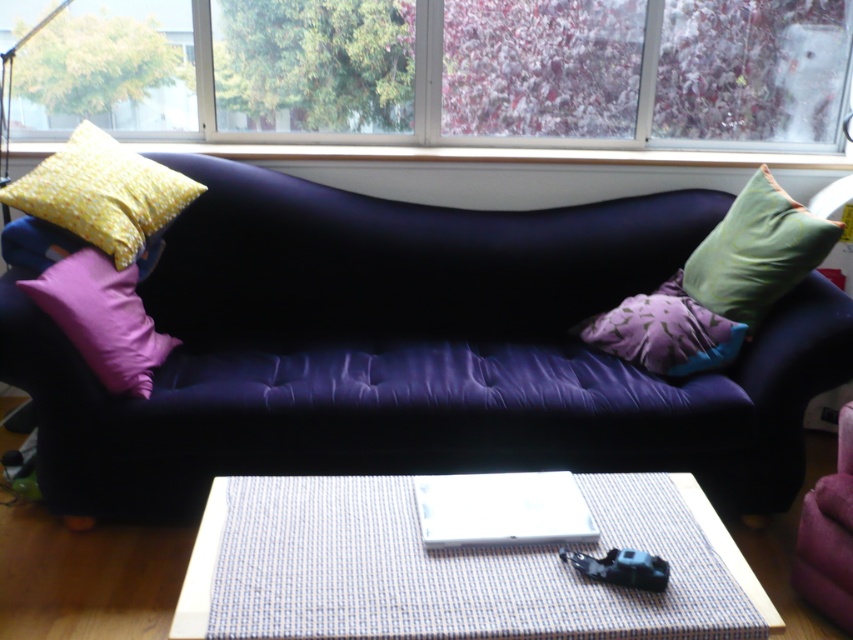
Consider the image. Is suede-like dark blue couch at center taller than purple fabric couch at lower right?

Correct, suede-like dark blue couch at center is much taller as purple fabric couch at lower right.

Between suede-like dark blue couch at center and purple fabric couch at lower right, which one appears on the left side from the viewer's perspective?

From the viewer's perspective, suede-like dark blue couch at center appears more on the left side.

The image size is (853, 640). Find the location of `suede-like dark blue couch at center`. suede-like dark blue couch at center is located at coordinates (413, 352).

Is purple fabric pillow at left thinner than purple fabric pillow at center?

Yes.

Consider the image. Does purple fabric pillow at left appear on the left side of purple fabric pillow at center?

Indeed, purple fabric pillow at left is positioned on the left side of purple fabric pillow at center.

Is point (68, 288) positioned after point (630, 316)?

No, (68, 288) is in front of (630, 316).

The width and height of the screenshot is (853, 640). What are the coordinates of `purple fabric pillow at left` in the screenshot? It's located at (102, 317).

Does green fabric pillow at right have a larger size compared to purple fabric pillow at left?

Yes, green fabric pillow at right is bigger than purple fabric pillow at left.

Between point (734, 225) and point (137, 365), which one is positioned in front?

Positioned in front is point (137, 365).

Who is more forward, [791,284] or [54,321]?

Point [54,321]

You are a GUI agent. You are given a task and a screenshot of the screen. Output one action in this format:
    pyautogui.click(x=<x>, y=<y>)
    Task: Click on the green fabric pillow at right
    The image size is (853, 640).
    Given the screenshot: What is the action you would take?
    (756, 252)